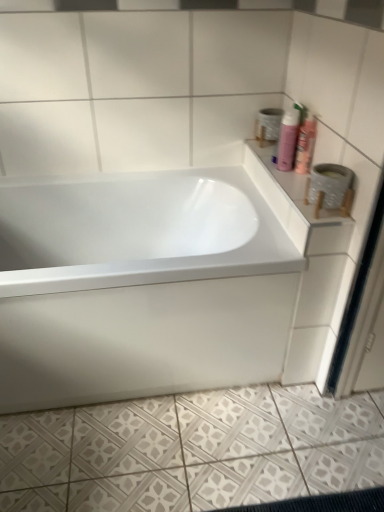
Identify the location of vacant area on top of white textured tile at lower center (from a real-world perspective). The image size is (384, 512). (211, 444).